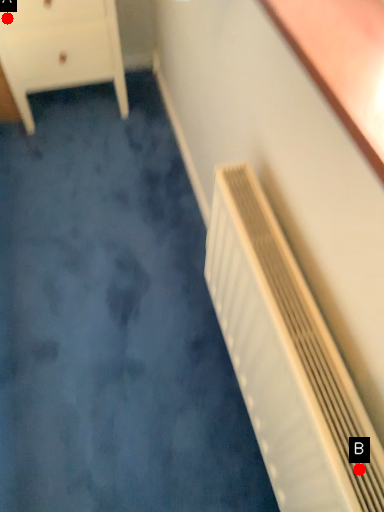
Question: Two points are circled on the image, labeled by A and B beside each circle. Which of the following is the farthest from the observer?

Choices:
 (A) A is further
 (B) B is further

Answer: (A)